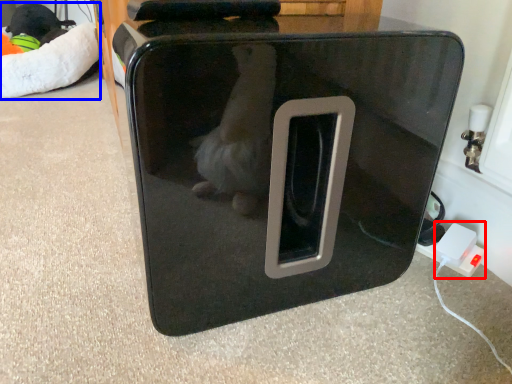
Question: Which point is closer to the camera, electric outlet (highlighted by a red box) or bean bag chair (highlighted by a blue box)?

Choices:
 (A) electric outlet
 (B) bean bag chair

Answer: (A)